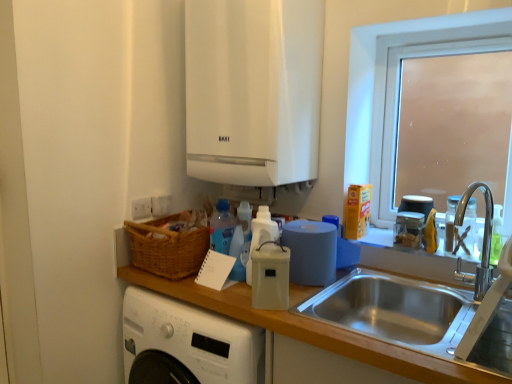
I want to click on clear plastic container at upper right, the 2th appliance viewed from the front, so click(409, 229).

Find the location of a particular element. This screenshot has height=384, width=512. stainless steel sink at lower right is located at coordinates (394, 310).

The image size is (512, 384). Describe the element at coordinates (270, 276) in the screenshot. I see `beige plastic container at center, which is the 1th appliance from front to back` at that location.

Find the location of a particular element. Image resolution: width=512 pixels, height=384 pixels. white glossy boiler at upper center is located at coordinates (253, 90).

Is blue matte paper towel at right not inside clear plastic container at upper right, the 2th appliance viewed from the front?

Yes, blue matte paper towel at right is outside of clear plastic container at upper right, the 2th appliance viewed from the front.

Can you confirm if blue matte paper towel at right is thinner than clear plastic container at upper right, positioned as the second appliance in back-to-front order?

Incorrect, the width of blue matte paper towel at right is not less than that of clear plastic container at upper right, positioned as the second appliance in back-to-front order.

From the image's perspective, is blue matte paper towel at right on clear plastic container at upper right, which appears as the second appliance when viewed from the right?

No, from the image's perspective, blue matte paper towel at right is not on top of clear plastic container at upper right, which appears as the second appliance when viewed from the right.

Looking at this image, which is closer to the camera, (276, 155) or (429, 198)?

The point (276, 155) is closer.

Can you confirm if white glossy boiler at upper center is wider than translucent glass jar at upper right, marked as the 1th appliance in a back-to-front arrangement?

Correct, the width of white glossy boiler at upper center exceeds that of translucent glass jar at upper right, marked as the 1th appliance in a back-to-front arrangement.

Is white glossy boiler at upper center smaller than translucent glass jar at upper right, marked as the 1th appliance in a back-to-front arrangement?

Incorrect, white glossy boiler at upper center is not smaller in size than translucent glass jar at upper right, marked as the 1th appliance in a back-to-front arrangement.

Considering the sizes of objects white glossy boiler at upper center and translucent glass jar at upper right, marked as the 1th appliance in a back-to-front arrangement, in the image provided, who is taller, white glossy boiler at upper center or translucent glass jar at upper right, marked as the 1th appliance in a back-to-front arrangement,?

white glossy boiler at upper center is taller.

Consider the image. From the image's perspective, which object appears higher, clear glass bottle at right, which is the second bottle from left to right, or beige plastic container at center, placed as the third appliance when sorted from right to left?

clear glass bottle at right, which is the second bottle from left to right, from the image's perspective.

Is beige plastic container at center, placed as the third appliance when sorted from right to left, at the back of clear glass bottle at right, which is the second bottle from left to right?

That's not correct — clear glass bottle at right, which is the second bottle from left to right, is not looking away from beige plastic container at center, placed as the third appliance when sorted from right to left.

From a real-world perspective, is clear glass bottle at right, which is the second bottle from left to right, positioned under beige plastic container at center, which is the 1th appliance from front to back, based on gravity?

No, from a real-world perspective, clear glass bottle at right, which is the second bottle from left to right, is not under beige plastic container at center, which is the 1th appliance from front to back.

Can you confirm if clear glass bottle at right, which is counted as the 1th bottle, starting from the right, is thinner than beige plastic container at center, the 3th appliance positioned from the back?

Yes.

Considering the sizes of objects blue matte paper towel at right and white glossy boiler at upper center in the image provided, who is shorter, blue matte paper towel at right or white glossy boiler at upper center?

With less height is blue matte paper towel at right.

Is white glossy boiler at upper center completely or partially inside blue matte paper towel at right?

No, white glossy boiler at upper center is not surrounded by blue matte paper towel at right.

Considering the relative sizes of blue matte paper towel at right and white glossy boiler at upper center in the image provided, is blue matte paper towel at right thinner than white glossy boiler at upper center?

Yes, blue matte paper towel at right is thinner than white glossy boiler at upper center.

Which object is positioned more to the left, blue matte paper towel at right or white glossy boiler at upper center?

white glossy boiler at upper center.

Choose the correct answer: Is translucent glass jar at upper right, arranged as the third appliance when viewed from the left, inside blue matte paper towel at right or outside it?

translucent glass jar at upper right, arranged as the third appliance when viewed from the left, cannot be found inside blue matte paper towel at right.

Would you say translucent glass jar at upper right, which ranks as the first appliance in right-to-left order, is to the left or to the right of blue matte paper towel at right in the picture?

translucent glass jar at upper right, which ranks as the first appliance in right-to-left order, is positioned on blue matte paper towel at right's right side.

Which of these two, translucent glass jar at upper right, arranged as the third appliance when viewed from the left, or blue matte paper towel at right, stands shorter?

Standing shorter between the two is translucent glass jar at upper right, arranged as the third appliance when viewed from the left.

Identify the location of the 2nd appliance behind the blue matte paper towel at right, counting from the anchor's position. The width and height of the screenshot is (512, 384). (425, 218).

Is white plastic bottle at center, the second bottle in the right-to-left sequence, turned away from blue matte paper towel at right?

No, white plastic bottle at center, the second bottle in the right-to-left sequence, is not facing the opposite direction of blue matte paper towel at right.

Which is in front, point (273, 230) or point (294, 259)?

The point (294, 259) is more forward.

Would you say white plastic bottle at center, the second bottle in the right-to-left sequence, is to the left or to the right of blue matte paper towel at right in the picture?

Clearly, white plastic bottle at center, the second bottle in the right-to-left sequence, is on the left of blue matte paper towel at right in the image.

Is clear glass bottle at right, which is counted as the 1th bottle, starting from the right, at the left side of stainless steel sink at lower right?

No.

Which object is further away from the camera taking this photo, clear glass bottle at right, which is the second bottle from left to right, or stainless steel sink at lower right?

clear glass bottle at right, which is the second bottle from left to right, is more distant.

From a real-world perspective, between clear glass bottle at right, which is counted as the 1th bottle, starting from the right, and stainless steel sink at lower right, who is vertically higher?

From a 3D spatial view, clear glass bottle at right, which is counted as the 1th bottle, starting from the right, is above.

From the image's perspective, is clear glass bottle at right, which is the second bottle from left to right, positioned above or below stainless steel sink at lower right?

From the image's perspective, clear glass bottle at right, which is the second bottle from left to right, appears above stainless steel sink at lower right.

What are the coordinates of `paper towel on the left of clear plastic container at upper right, positioned as the 2th appliance in left-to-right order` in the screenshot? It's located at (311, 252).

The width and height of the screenshot is (512, 384). I want to click on cabinetry in front of the translucent glass jar at upper right, marked as the 1th appliance in a back-to-front arrangement, so click(253, 90).

When comparing their distances from clear glass bottle at right, which is counted as the 1th bottle, starting from the right, does white plastic bottle at center, the second bottle in the right-to-left sequence, or wooden at left seem further?

Among the two, wooden at left is located further to clear glass bottle at right, which is counted as the 1th bottle, starting from the right.

Which object lies nearer to the anchor point stainless steel sink at lower right, white glossy boiler at upper center or frosted glass window at upper right?

The object closer to stainless steel sink at lower right is frosted glass window at upper right.

From the image, which object appears to be nearer to wooden at left, frosted glass window at upper right or clear glass bottle at right, which is the second bottle from left to right?

clear glass bottle at right, which is the second bottle from left to right, is closer to wooden at left.

Considering their positions, is blue matte paper towel at right positioned further to white glossy boiler at upper center than stainless steel sink at lower right?

Based on the image, stainless steel sink at lower right appears to be further to white glossy boiler at upper center.

Considering their positions, is white plastic bottle at center, which is counted as the first bottle, starting from the left, positioned closer to beige plastic container at center, placed as the third appliance when sorted from right to left, than clear glass bottle at right, which is the second bottle from left to right?

white plastic bottle at center, which is counted as the first bottle, starting from the left.

From the image, which object appears to be nearer to white plastic bottle at center, the second bottle in the right-to-left sequence, translucent glass jar at upper right, which is the third appliance from front to back, or frosted glass window at upper right?

Based on the image, translucent glass jar at upper right, which is the third appliance from front to back, appears to be nearer to white plastic bottle at center, the second bottle in the right-to-left sequence.

Which object lies further to the anchor point wooden at left, white glossy boiler at upper center or clear glass bottle at right, which is counted as the 1th bottle, starting from the right?

Based on the image, clear glass bottle at right, which is counted as the 1th bottle, starting from the right, appears to be further to wooden at left.

Based on their spatial positions, is frosted glass window at upper right or blue matte paper towel at right closer to stainless steel sink at lower right?

blue matte paper towel at right lies closer to stainless steel sink at lower right than the other object.

The height and width of the screenshot is (384, 512). I want to click on appliance positioned between wooden at left and blue matte paper towel at right from near to far, so click(270, 276).

What are the coordinates of `paper towel situated between beige plastic container at center, positioned as the first appliance in left-to-right order, and clear plastic container at upper right, positioned as the 2th appliance in left-to-right order, from left to right` in the screenshot? It's located at click(311, 252).

The width and height of the screenshot is (512, 384). In order to click on paper towel between beige plastic container at center, which is the 1th appliance from front to back, and clear glass bottle at right, which is the second bottle from left to right in this screenshot , I will do `click(311, 252)`.

This screenshot has width=512, height=384. Identify the location of sink situated between white plastic bottle at center, which is counted as the first bottle, starting from the left, and translucent glass jar at upper right, arranged as the third appliance when viewed from the left, from left to right. (394, 310).